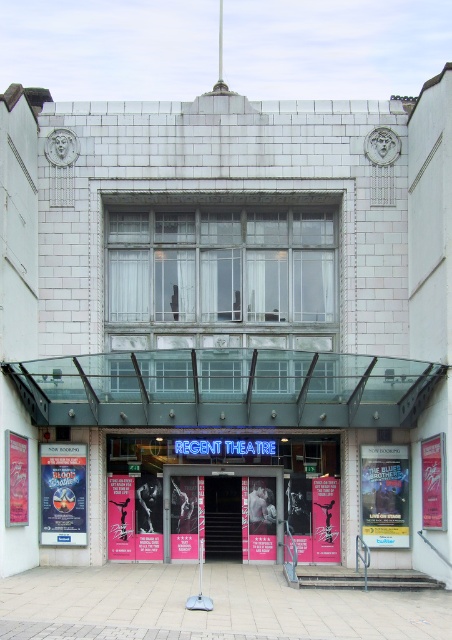
You are standing in front of the Regent Theatre. You see a point marked at coordinates (221, 497). What object is located at that point?

The point at coordinates (221, 497) corresponds to the pink glossy posters at center.

You are standing in front of the Regent Theatre and notice two posters at the center. Which poster is closer to you, the blue glossy poster at center or the pink poster at center?

The blue glossy poster at center is closer to you because it is in front of the pink poster at center.